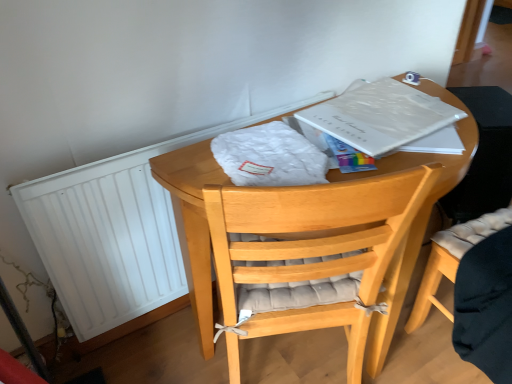
What do you see at coordinates (193, 222) in the screenshot? Image resolution: width=512 pixels, height=384 pixels. I see `wooden round table at center` at bounding box center [193, 222].

Where is `wooden round table at center`? This screenshot has height=384, width=512. wooden round table at center is located at coordinates (193, 222).

Which of these two, wooden round table at center or light brown wooden chair at center, is smaller?

With smaller size is light brown wooden chair at center.

Which is nearer, (394, 169) or (497, 218)?

The point (394, 169) is more forward.

Based on the photo, would you say wooden round table at center is a long distance from light brown wooden chair at center?

wooden round table at center is actually quite close to light brown wooden chair at center.

Considering the relative sizes of wooden round table at center and light brown wooden chair at center in the image provided, is wooden round table at center taller than light brown wooden chair at center?

Yes.

Does wooden round table at center have a greater width compared to white paper at upper right?

Correct, the width of wooden round table at center exceeds that of white paper at upper right.

Which object is closer to the camera taking this photo, wooden round table at center or white paper at upper right?

wooden round table at center.

Looking at this image, from a real-world perspective, between wooden round table at center and white paper at upper right, who is vertically lower?

wooden round table at center.

Considering the relative sizes of white paper at upper right and wooden round table at center in the image provided, is white paper at upper right bigger than wooden round table at center?

No.

From the picture: Between white paper at upper right and wooden round table at center, which one has less height?

white paper at upper right is shorter.

Which is more to the right, white paper at upper right or wooden round table at center?

white paper at upper right.

This screenshot has width=512, height=384. I want to click on paperback book above the wooden round table at center (from a real-world perspective), so click(388, 119).

Is white paper at upper right at the right side of light brown wooden chair at center?

No, white paper at upper right is not to the right of light brown wooden chair at center.

From the image's perspective, does white paper at upper right appear higher than light brown wooden chair at center?

Yes, from the image's perspective, white paper at upper right is on top of light brown wooden chair at center.

From a real-world perspective, between white paper at upper right and light brown wooden chair at center, who is vertically higher?

white paper at upper right.

Identify the location of radiator behind the wooden round table at center. This screenshot has width=512, height=384. (115, 232).

Which is more to the left, white matte radiator at left or wooden round table at center?

From the viewer's perspective, white matte radiator at left appears more on the left side.

From a real-world perspective, which is physically below, white matte radiator at left or wooden round table at center?

wooden round table at center is physically lower.

Is white matte radiator at left oriented away from wooden round table at center?

Yes.

You are a GUI agent. You are given a task and a screenshot of the screen. Output one action in this format:
    pyautogui.click(x=<x>, y=<y>)
    Task: Click on the chair that appears below the white matte radiator at left (from a real-world perspective)
    The height and width of the screenshot is (384, 512).
    Given the screenshot: What is the action you would take?
    pyautogui.click(x=452, y=260)

Could you tell me if light brown wooden chair at center is facing white matte radiator at left?

No.

From the picture: Considering the relative sizes of light brown wooden chair at center and white matte radiator at left in the image provided, is light brown wooden chair at center thinner than white matte radiator at left?

In fact, light brown wooden chair at center might be wider than white matte radiator at left.

Is light brown wooden chair at center inside the boundaries of white matte radiator at left, or outside?

The correct answer is: outside.

Which object is more forward, light brown wooden chair at center or white paper at upper right?

light brown wooden chair at center is in front.

From a real-world perspective, is light brown wooden chair at center positioned above or below white paper at upper right?

Clearly, from a real-world perspective, light brown wooden chair at center is below white paper at upper right.

Consider the image. Is light brown wooden chair at center looking in the opposite direction of white paper at upper right?

light brown wooden chair at center does not have its back to white paper at upper right.

Considering the positions of objects light brown wooden chair at center and white paper at upper right in the image provided, who is more to the left, light brown wooden chair at center or white paper at upper right?

Positioned to the left is white paper at upper right.

The width and height of the screenshot is (512, 384). I want to click on round table in front of the light brown wooden chair at center, so click(193, 222).

I want to click on round table below the white paper at upper right (from a real-world perspective), so click(193, 222).

From the image, which object appears to be nearer to light brown wooden chair at center, wooden round table at center or white matte radiator at left?

wooden round table at center lies closer to light brown wooden chair at center than the other object.

When comparing their distances from white paper at upper right, does white matte radiator at left or wooden round table at center seem closer?

Based on the image, wooden round table at center appears to be nearer to white paper at upper right.

Considering their positions, is light brown wooden chair at center positioned further to wooden round table at center than white matte radiator at left?

light brown wooden chair at center.

Consider the image. Estimate the real-world distances between objects in this image. Which object is closer to white matte radiator at left, wooden round table at center or light brown wooden chair at center?

wooden round table at center.

Estimate the real-world distances between objects in this image. Which object is closer to white matte radiator at left, light brown wooden chair at center or wooden round table at center?

The object closer to white matte radiator at left is wooden round table at center.

From the image, which object appears to be farther from white paper at upper right, wooden round table at center or white matte radiator at left?

white matte radiator at left is positioned further to the anchor white paper at upper right.

Looking at the image, which one is located closer to white paper at upper right, light brown wooden chair at center or wooden round table at center?

The object closer to white paper at upper right is wooden round table at center.

From the image, which object appears to be farther from white paper at upper right, wooden round table at center or light brown wooden chair at center?

light brown wooden chair at center lies further to white paper at upper right than the other object.

Where is `round table that lies between white paper at upper right and light brown wooden chair at center from top to bottom`? Image resolution: width=512 pixels, height=384 pixels. round table that lies between white paper at upper right and light brown wooden chair at center from top to bottom is located at coordinates (193, 222).

The width and height of the screenshot is (512, 384). In order to click on round table located between white matte radiator at left and light brown wooden chair at center in the left-right direction in this screenshot , I will do `click(193, 222)`.

You are a GUI agent. You are given a task and a screenshot of the screen. Output one action in this format:
    pyautogui.click(x=<x>, y=<y>)
    Task: Click on the paperback book between white matte radiator at left and light brown wooden chair at center from left to right
    Image resolution: width=512 pixels, height=384 pixels.
    Given the screenshot: What is the action you would take?
    point(388,119)

Image resolution: width=512 pixels, height=384 pixels. Find the location of `round table between white matte radiator at left and white paper at upper right from left to right`. round table between white matte radiator at left and white paper at upper right from left to right is located at coordinates 193,222.